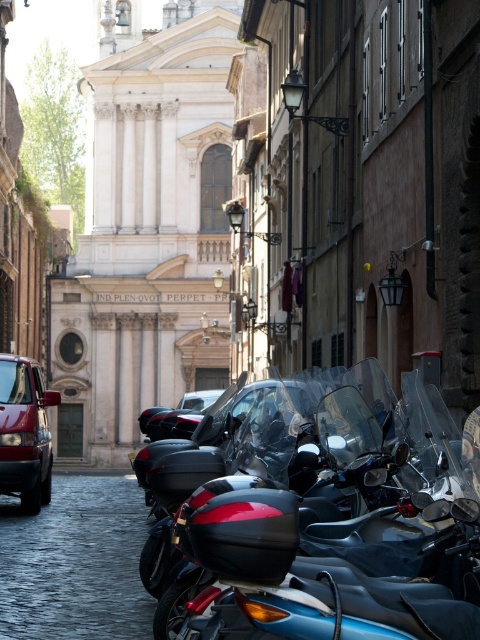
Question: Which point appears closest to the camera in this image?

Choices:
 (A) (389, 634)
 (B) (15, 420)

Answer: (A)

Question: Does black glossy motorcycle at center have a greater width compared to matte red van at left?

Choices:
 (A) no
 (B) yes

Answer: (B)

Question: Where is black glossy motorcycle at center located in relation to matte red van at left in the image?

Choices:
 (A) below
 (B) above

Answer: (B)

Question: Among these objects, which one is nearest to the camera?

Choices:
 (A) matte red van at left
 (B) black glossy motorcycle at center

Answer: (B)

Question: Is the position of black glossy motorcycle at center more distant than that of matte red van at left?

Choices:
 (A) yes
 (B) no

Answer: (B)